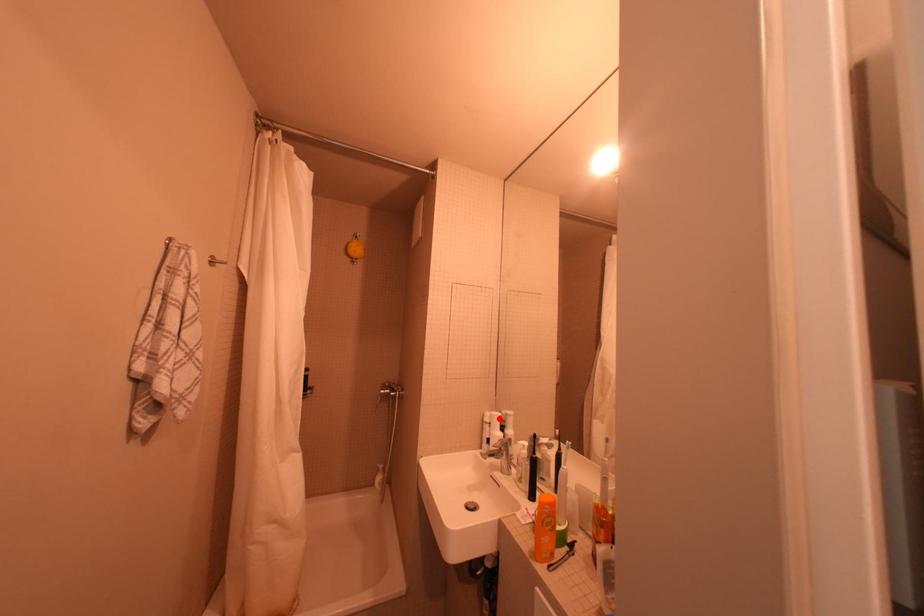
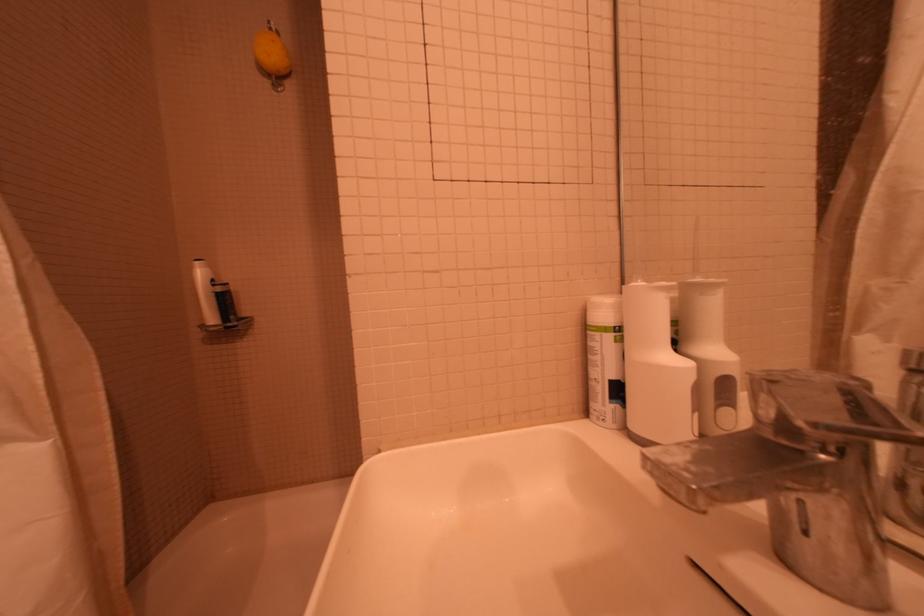
Question: I am providing you with two images of the same scene from different viewpoints. Given a red point in image1, look at the same physical point in image2. Is it:

Choices:
 (A) Closer to the viewpoint
 (B) Farther from the viewpoint

Answer: (A)